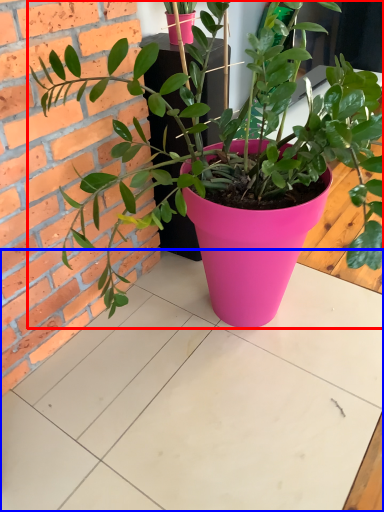
Question: Among these objects, which one is farthest to the camera, houseplant (highlighted by a red box) or table (highlighted by a blue box)?

Choices:
 (A) houseplant
 (B) table

Answer: (B)